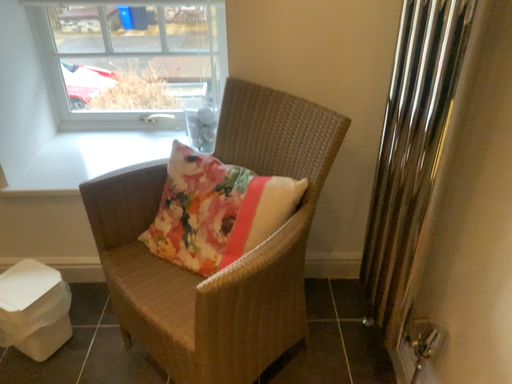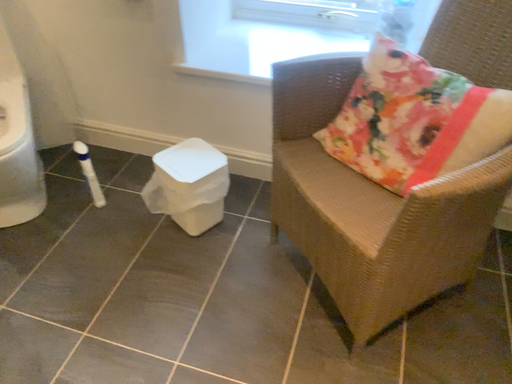
Question: Which way did the camera rotate in the video?

Choices:
 (A) rotated right
 (B) rotated left

Answer: (B)